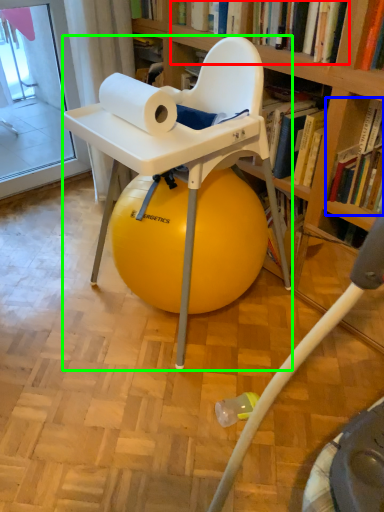
Question: Which is nearer to the book (highlighted by a red box)? book (highlighted by a blue box) or chair (highlighted by a green box).

Choices:
 (A) book
 (B) chair

Answer: (A)